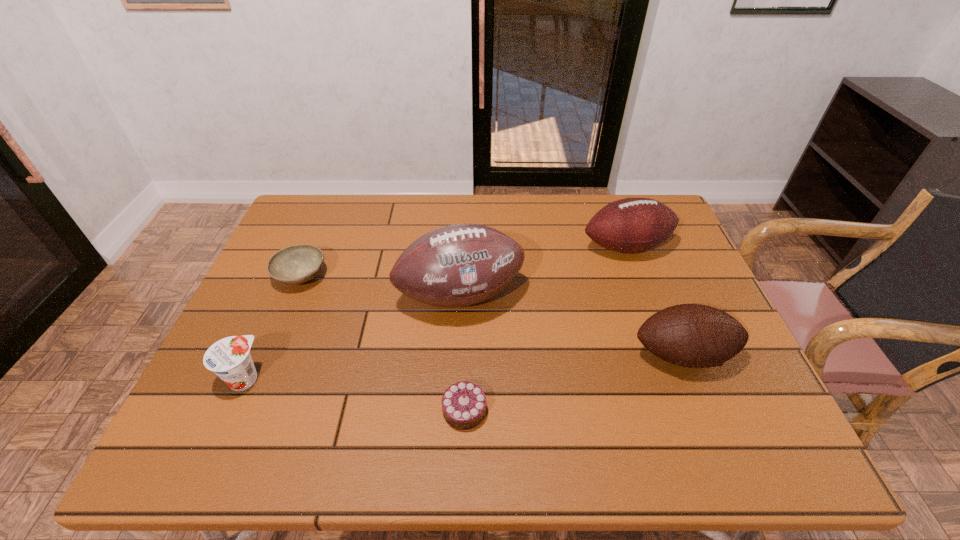
Locate an element on the screen. This screenshot has height=540, width=960. free space located on the back of the third shortest object is located at coordinates (279, 300).

Find the location of a particular element. vacant space situated on the left of the chocolate cake is located at coordinates (256, 410).

You are a GUI agent. You are given a task and a screenshot of the screen. Output one action in this format:
    pyautogui.click(x=<x>, y=<y>)
    Task: Click on the vacant space positioned 0.330m on the front of the bowl
    
    Given the screenshot: What is the action you would take?
    (x=246, y=405)

Find the location of a particular element. Image resolution: width=960 pixels, height=540 pixels. object present at the far edge is located at coordinates (631, 225).

Find the location of `object present at the near edge`. object present at the near edge is located at coordinates (464, 403).

At what (x,y) coordinates should I click in order to perform the action: click on yogurt that is at the left edge. Please return your answer as a coordinate pair (x, y). Looking at the image, I should click on (229, 358).

Locate an element on the screen. bowl that is at the left edge is located at coordinates pyautogui.click(x=297, y=264).

In order to click on object that is positioned at the far right corner in this screenshot , I will do `click(631, 225)`.

In the image, there is a desktop. Identify the location of vacant space at the far edge. (479, 218).

Where is `vacant space at the near edge of the desktop`? This screenshot has height=540, width=960. vacant space at the near edge of the desktop is located at coordinates (387, 432).